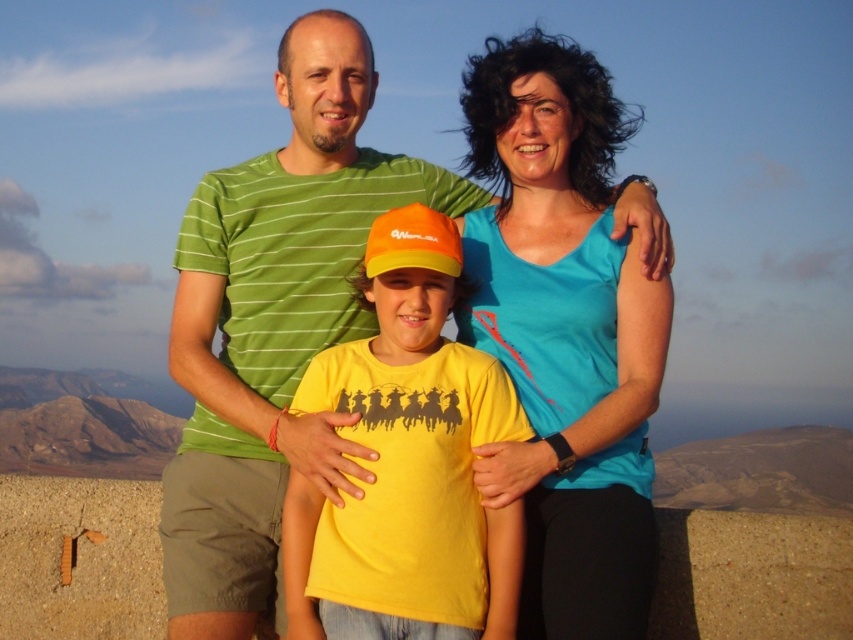
Looking at this image, can you confirm if green striped shirt at upper center is shorter than yellow matte t-shirt at center?

Incorrect, green striped shirt at upper center's height does not fall short of yellow matte t-shirt at center's.

Find the location of `green striped shirt at upper center`. green striped shirt at upper center is located at coordinates 274,323.

Between blue fabric tank top at upper center and yellow matte t-shirt at center, which one is positioned higher?

blue fabric tank top at upper center is above.

Between point (639, 449) and point (386, 262), which one is positioned behind?

The point (639, 449) is more distant.

Is point (502, 160) behind point (450, 593)?

Yes, point (502, 160) is farther from viewer.

The width and height of the screenshot is (853, 640). Identify the location of blue fabric tank top at upper center. (564, 333).

Does point (299, 195) come farther from viewer compared to point (599, 168)?

Yes, point (299, 195) is behind point (599, 168).

Describe the element at coordinates (274, 323) in the screenshot. The image size is (853, 640). I see `green striped shirt at upper center` at that location.

Where is `green striped shirt at upper center`? The height and width of the screenshot is (640, 853). green striped shirt at upper center is located at coordinates (274, 323).